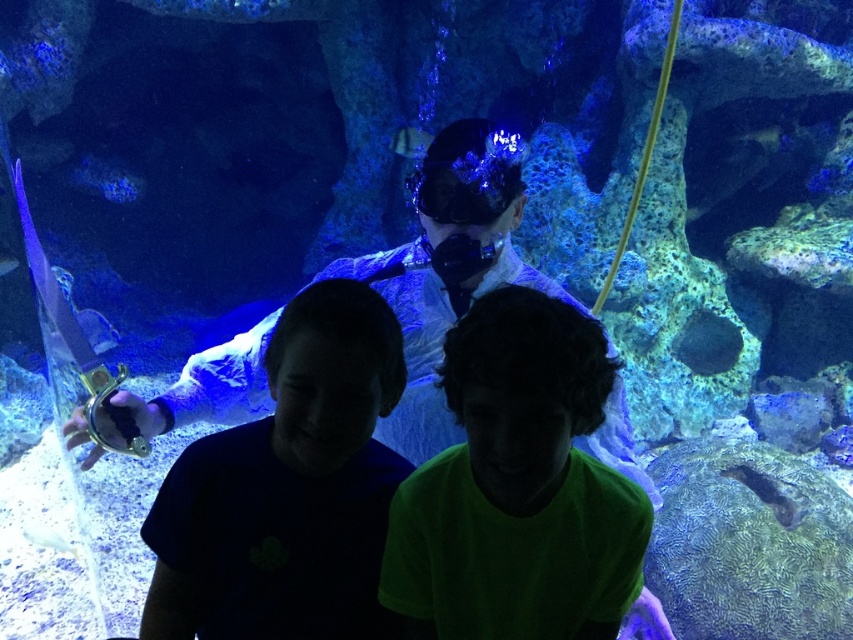
Question: Which object is the farthest from the translucent glass fish at upper center?

Choices:
 (A) white glossy fish at lower left
 (B) matte white diver at center
 (C) green matte shirt at center

Answer: (C)

Question: Estimate the real-world distances between objects in this image. Which object is closer to the white matte diving suit at center?

Choices:
 (A) translucent glass fish at upper center
 (B) matte white diver at center
 (C) white glossy fish at lower left

Answer: (B)

Question: Can you confirm if green matte shirt at center is positioned to the right of white glossy fish at lower left?

Choices:
 (A) yes
 (B) no

Answer: (A)

Question: Is matte white diver at center closer to camera compared to white glossy fish at lower left?

Choices:
 (A) no
 (B) yes

Answer: (B)

Question: Among these points, which one is nearest to the camera?

Choices:
 (A) (450, 168)
 (B) (403, 516)
 (C) (273, 376)

Answer: (C)

Question: Observing the image, what is the correct spatial positioning of matte white diver at center in reference to white matte diving suit at center?

Choices:
 (A) right
 (B) left

Answer: (B)